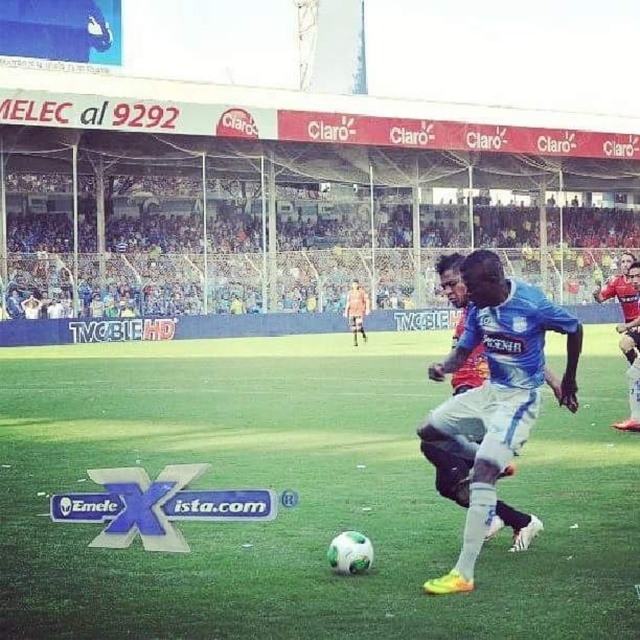
Question: Which of the following is the farthest from the observer?

Choices:
 (A) (616, 358)
 (B) (490, 442)

Answer: (A)

Question: Does green grass soccer ball at center have a smaller size compared to blue jersey at center?

Choices:
 (A) yes
 (B) no

Answer: (B)

Question: Which object is farther from the camera taking this photo?

Choices:
 (A) blue jersey at center
 (B) green grass soccer ball at center
 (C) light brown leather jacket at center

Answer: (C)

Question: Does green grass soccer ball at center appear under light brown leather jacket at center?

Choices:
 (A) no
 (B) yes

Answer: (B)

Question: Does blue jersey at center appear over light brown leather jacket at center?

Choices:
 (A) yes
 (B) no

Answer: (B)

Question: Which point is farther from the camera taking this photo?

Choices:
 (A) (500, 442)
 (B) (604, 584)

Answer: (A)